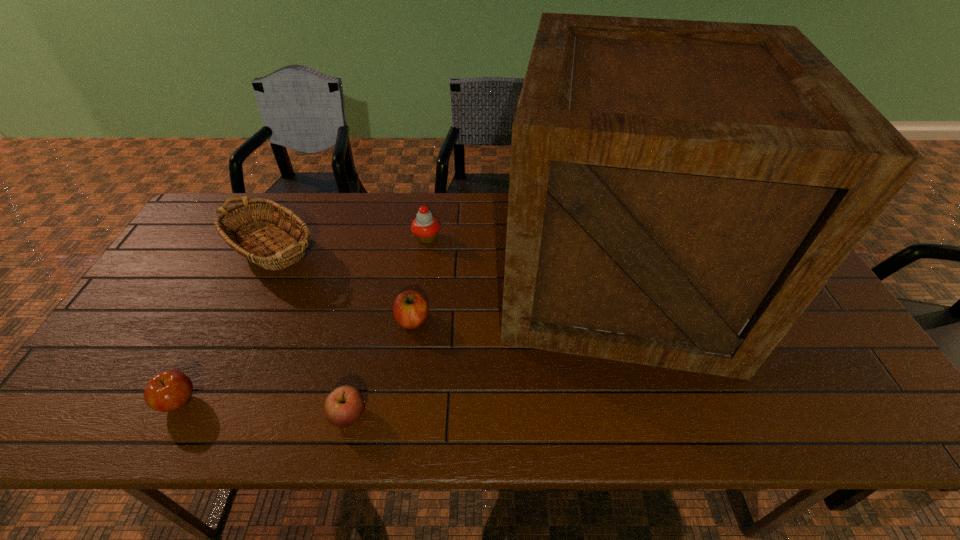
Where is `empty space that is in between the box and the leftmost apple`? empty space that is in between the box and the leftmost apple is located at coordinates (398, 339).

Identify which object is the fourth closest to the farthest apple. Please provide its 2D coordinates. Your answer should be formatted as a tuple, i.e. [(x, y)], where the tuple contains the x and y coordinates of a point satisfying the conditions above.

[(425, 227)]

The width and height of the screenshot is (960, 540). I want to click on object that can be found as the third closest to the basket, so click(170, 390).

Find the location of a particular element. The width and height of the screenshot is (960, 540). apple that is the second closest to the cupcake is located at coordinates (345, 405).

What are the coordinates of `apple that stands as the third closest to the basket` in the screenshot? It's located at (345, 405).

Locate an element on the screen. The height and width of the screenshot is (540, 960). vacant space that satisfies the following two spatial constraints: 1. on the back side of the leftmost apple; 2. on the left side of the rightmost apple is located at coordinates (222, 320).